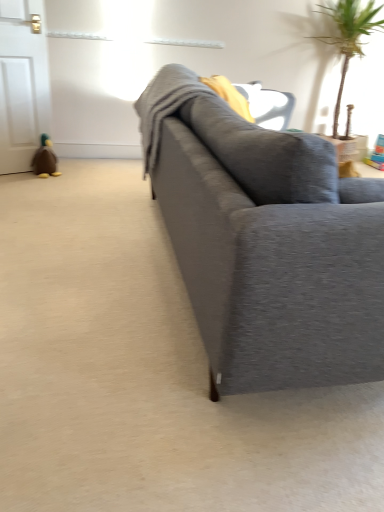
Where is `brown plush duck at left`? Image resolution: width=384 pixels, height=512 pixels. brown plush duck at left is located at coordinates (45, 159).

At what (x,y) coordinates should I click in order to perform the action: click on green leafy plant at upper right. Please return your answer as a coordinate pair (x, y). Image resolution: width=384 pixels, height=512 pixels. Looking at the image, I should click on (348, 36).

This screenshot has height=512, width=384. Describe the element at coordinates (266, 242) in the screenshot. I see `matte gray couch at center` at that location.

Locate an element on the screen. brown plush duck at left is located at coordinates (45, 159).

Would you say brown plush duck at left is to the left or to the right of green leafy plant at upper right in the picture?

Based on their positions, brown plush duck at left is located to the left of green leafy plant at upper right.

The width and height of the screenshot is (384, 512). I want to click on toy located underneath the green leafy plant at upper right (from a real-world perspective), so click(x=45, y=159).

In the scene shown: Considering the relative sizes of brown plush duck at left and green leafy plant at upper right in the image provided, is brown plush duck at left bigger than green leafy plant at upper right?

No.

Considering the sizes of brown plush duck at left and green leafy plant at upper right in the image, is brown plush duck at left wider or thinner than green leafy plant at upper right?

Clearly, brown plush duck at left has less width compared to green leafy plant at upper right.

From a real-world perspective, is matte gray couch at center positioned under brown plush duck at left based on gravity?

No, from a real-world perspective, matte gray couch at center is not under brown plush duck at left.

Is matte gray couch at center not within brown plush duck at left?

Yes.

Is matte gray couch at center next to brown plush duck at left?

matte gray couch at center is not next to brown plush duck at left, and they're not touching.

Identify the location of toy on the left side of matte gray couch at center. Image resolution: width=384 pixels, height=512 pixels. (45, 159).

Is brown plush duck at left at the right side of matte gray couch at center?

In fact, brown plush duck at left is to the left of matte gray couch at center.

Is brown plush duck at left oriented away from matte gray couch at center?

No.

The height and width of the screenshot is (512, 384). I want to click on houseplant above the brown plush duck at left (from the image's perspective), so click(348, 36).

From the image's perspective, is green leafy plant at upper right positioned above or below brown plush duck at left?

Based on their image positions, green leafy plant at upper right is located above brown plush duck at left.

How many degrees apart are the facing directions of green leafy plant at upper right and brown plush duck at left?

They differ by 24.4 degrees in their facing directions.

The image size is (384, 512). I want to click on houseplant that appears behind the matte gray couch at center, so click(348, 36).

In terms of height, does green leafy plant at upper right look taller or shorter compared to matte gray couch at center?

green leafy plant at upper right is taller than matte gray couch at center.

Who is bigger, green leafy plant at upper right or matte gray couch at center?

matte gray couch at center is bigger.

Is matte gray couch at center completely or partially outside of green leafy plant at upper right?

Yes.

Based on the photo, is matte gray couch at center turned away from green leafy plant at upper right?

No, matte gray couch at center's orientation is not away from green leafy plant at upper right.

Is matte gray couch at center positioned before green leafy plant at upper right?

Yes, the depth of matte gray couch at center is less than that of green leafy plant at upper right.

In terms of size, does matte gray couch at center appear bigger or smaller than green leafy plant at upper right?

In the image, matte gray couch at center appears to be larger than green leafy plant at upper right.

The height and width of the screenshot is (512, 384). I want to click on houseplant above the brown plush duck at left (from the image's perspective), so click(348, 36).

Locate an element on the screen. Image resolution: width=384 pixels, height=512 pixels. studio couch located in front of the brown plush duck at left is located at coordinates (266, 242).

Which object lies nearer to the anchor point brown plush duck at left, matte gray couch at center or green leafy plant at upper right?

Among the two, matte gray couch at center is located nearer to brown plush duck at left.

Estimate the real-world distances between objects in this image. Which object is closer to matte gray couch at center, green leafy plant at upper right or brown plush duck at left?

brown plush duck at left is positioned closer to the anchor matte gray couch at center.

Estimate the real-world distances between objects in this image. Which object is closer to brown plush duck at left, green leafy plant at upper right or matte gray couch at center?

matte gray couch at center is positioned closer to the anchor brown plush duck at left.

In the scene shown: Estimate the real-world distances between objects in this image. Which object is closer to green leafy plant at upper right, matte gray couch at center or brown plush duck at left?

brown plush duck at left is closer to green leafy plant at upper right.

When comparing their distances from green leafy plant at upper right, does brown plush duck at left or matte gray couch at center seem further?

Based on the image, matte gray couch at center appears to be further to green leafy plant at upper right.

Which object lies nearer to the anchor point matte gray couch at center, brown plush duck at left or green leafy plant at upper right?

brown plush duck at left.

Locate an element on the screen. houseplant positioned between matte gray couch at center and brown plush duck at left from near to far is located at coordinates (348, 36).